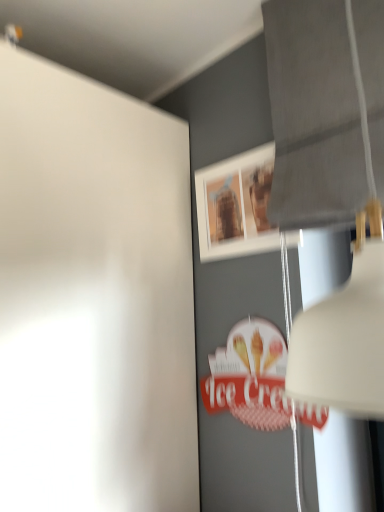
This screenshot has height=512, width=384. Describe the element at coordinates (236, 205) in the screenshot. I see `matte wooden picture frame at upper center` at that location.

Image resolution: width=384 pixels, height=512 pixels. I want to click on matte wooden picture frame at upper center, so click(236, 205).

This screenshot has width=384, height=512. What do you see at coordinates (313, 115) in the screenshot? I see `white matte lampshade at upper right` at bounding box center [313, 115].

Find the location of a particular element. Image resolution: width=384 pixels, height=512 pixels. white matte lampshade at upper right is located at coordinates (313, 115).

In order to face white matte lampshade at upper right, should I rotate leftwards or rightwards?

To face it directly, rotate right by 20.147 degrees.

This screenshot has height=512, width=384. Find the location of `matte wooden picture frame at upper center`. matte wooden picture frame at upper center is located at coordinates [x=236, y=205].

From the picture: Considering the positions of objects matte wooden picture frame at upper center and white matte lampshade at upper right in the image provided, who is more to the right, matte wooden picture frame at upper center or white matte lampshade at upper right?

From the viewer's perspective, white matte lampshade at upper right appears more on the right side.

In the image, is matte wooden picture frame at upper center positioned in front of or behind white matte lampshade at upper right?

Clearly, matte wooden picture frame at upper center is behind white matte lampshade at upper right.

Does point (224, 244) appear closer or farther from the camera than point (330, 395)?

Point (224, 244).

From the image's perspective, does matte wooden picture frame at upper center appear lower than white matte lampshade at upper right?

Yes.

From a real-world perspective, between matte wooden picture frame at upper center and white matte lampshade at upper right, who is vertically lower?

white matte lampshade at upper right.

Does matte wooden picture frame at upper center have a greater width compared to white matte lampshade at upper right?

Incorrect, the width of matte wooden picture frame at upper center does not surpass that of white matte lampshade at upper right.

In terms of height, does matte wooden picture frame at upper center look taller or shorter compared to white matte lampshade at upper right?

Considering their sizes, matte wooden picture frame at upper center has less height than white matte lampshade at upper right.

Between matte wooden picture frame at upper center and white matte lampshade at upper right, which one has larger size?

Bigger between the two is white matte lampshade at upper right.

Would you say matte wooden picture frame at upper center contains white matte lampshade at upper right?

That's incorrect, white matte lampshade at upper right is not inside matte wooden picture frame at upper center.

Is matte wooden picture frame at upper center next to white matte lampshade at upper right and touching it?

No, matte wooden picture frame at upper center is not touching white matte lampshade at upper right.

Is matte wooden picture frame at upper center oriented away from white matte lampshade at upper right?

No, matte wooden picture frame at upper center is not facing away from white matte lampshade at upper right.

Can you tell me how much matte wooden picture frame at upper center and white matte lampshade at upper right differ in facing direction?

There is a 0.761-degree angle between the facing directions of matte wooden picture frame at upper center and white matte lampshade at upper right.

I want to click on picture frame located below the white matte lampshade at upper right (from the image's perspective), so click(x=236, y=205).

Consider the image. Would you say white matte lampshade at upper right is to the left or to the right of matte wooden picture frame at upper center in the picture?

white matte lampshade at upper right is to the right of matte wooden picture frame at upper center.

Considering the relative positions of white matte lampshade at upper right and matte wooden picture frame at upper center in the image provided, is white matte lampshade at upper right in front of matte wooden picture frame at upper center?

Yes, it is.

Considering the positions of point (336, 36) and point (195, 174), is point (336, 36) closer or farther from the camera than point (195, 174)?

Point (336, 36).

From the image's perspective, which object appears higher, white matte lampshade at upper right or matte wooden picture frame at upper center?

white matte lampshade at upper right is shown above in the image.

From a real-world perspective, is white matte lampshade at upper right positioned over matte wooden picture frame at upper center based on gravity?

No, from a real-world perspective, white matte lampshade at upper right is not above matte wooden picture frame at upper center.

Considering the sizes of white matte lampshade at upper right and matte wooden picture frame at upper center in the image, is white matte lampshade at upper right wider or thinner than matte wooden picture frame at upper center?

In the image, white matte lampshade at upper right appears to be wider than matte wooden picture frame at upper center.

From their relative heights in the image, would you say white matte lampshade at upper right is taller or shorter than matte wooden picture frame at upper center?

white matte lampshade at upper right is taller than matte wooden picture frame at upper center.

Looking at the image, does white matte lampshade at upper right seem bigger or smaller compared to matte wooden picture frame at upper center?

In the image, white matte lampshade at upper right appears to be larger than matte wooden picture frame at upper center.

Is white matte lampshade at upper right not inside matte wooden picture frame at upper center?

Yes, white matte lampshade at upper right is outside of matte wooden picture frame at upper center.

Are white matte lampshade at upper right and matte wooden picture frame at upper center beside each other?

No, white matte lampshade at upper right is not beside matte wooden picture frame at upper center.

Consider the image. Could you tell me if white matte lampshade at upper right is facing matte wooden picture frame at upper center?

No.

How different are the orientations of white matte lampshade at upper right and matte wooden picture frame at upper center in degrees?

The facing directions of white matte lampshade at upper right and matte wooden picture frame at upper center are 0.761 degrees apart.

Measure the distance from white matte lampshade at upper right to matte wooden picture frame at upper center.

white matte lampshade at upper right is 7.28 inches away from matte wooden picture frame at upper center.

Locate an element on the screen. lamp that is on the right side of matte wooden picture frame at upper center is located at coordinates (313, 115).

At what (x,y) coordinates should I click in order to perform the action: click on picture frame below the white matte lampshade at upper right (from the image's perspective). Please return your answer as a coordinate pair (x, y). This screenshot has height=512, width=384. Looking at the image, I should click on (236, 205).

Identify the location of picture frame behind the white matte lampshade at upper right. The width and height of the screenshot is (384, 512). (236, 205).